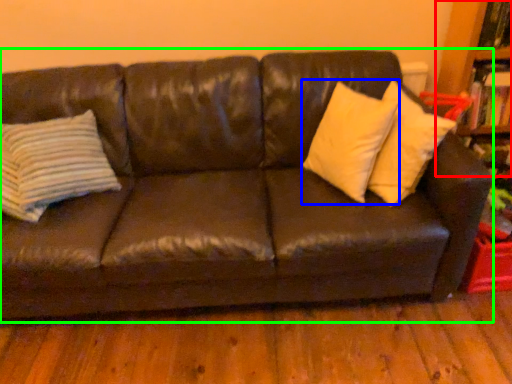
Question: Estimate the real-world distances between objects in this image. Which object is farther from bookcase (highlighted by a red box), pillow (highlighted by a blue box) or studio couch (highlighted by a green box)?

Choices:
 (A) pillow
 (B) studio couch

Answer: (B)